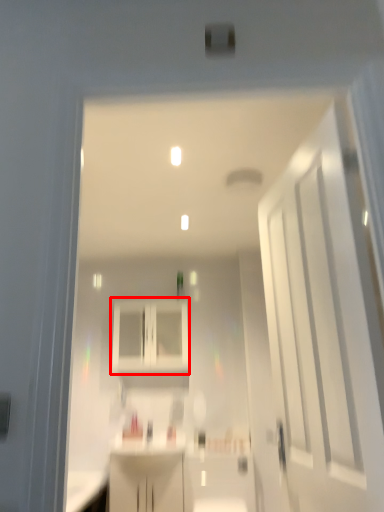
Question: From the image's perspective, what is the correct spatial positioning of cabinetry (annotated by the red box) in reference to door?

Choices:
 (A) below
 (B) above

Answer: (A)